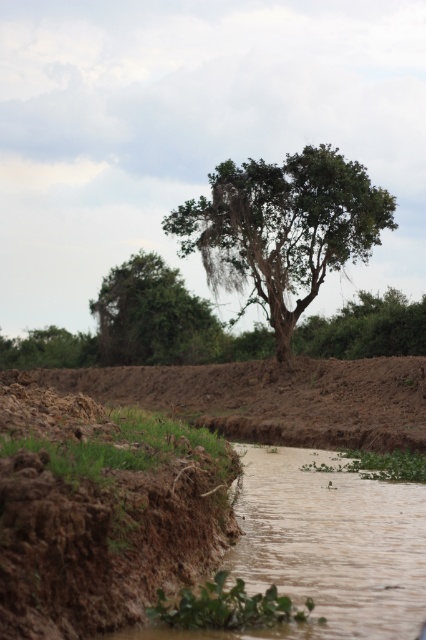
Does point (181, 234) come behind point (22, 362)?

No.

This screenshot has width=426, height=640. I want to click on green leafy tree at center, so (x=282, y=228).

Find the location of a particular element. green leafy tree at center is located at coordinates (282, 228).

Can you confirm if green leafy tree at center is positioned above brown muddy field at center?

Yes.

Who is more distant from viewer, (226, 232) or (176, 410)?

Positioned behind is point (226, 232).

Find the location of a particular element. The height and width of the screenshot is (640, 426). green leafy tree at center is located at coordinates (282, 228).

Can you confirm if brown muddy field at center is shorter than green leafy tree at lower left?

Yes.

This screenshot has height=640, width=426. What do you see at coordinates (273, 397) in the screenshot?
I see `brown muddy field at center` at bounding box center [273, 397].

The width and height of the screenshot is (426, 640). Find the location of `brown muddy field at center`. brown muddy field at center is located at coordinates (273, 397).